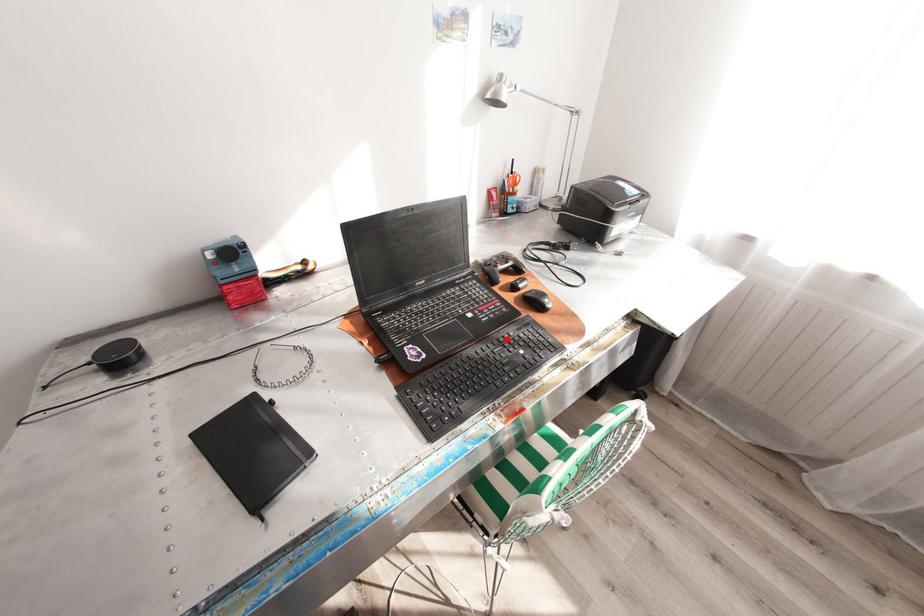
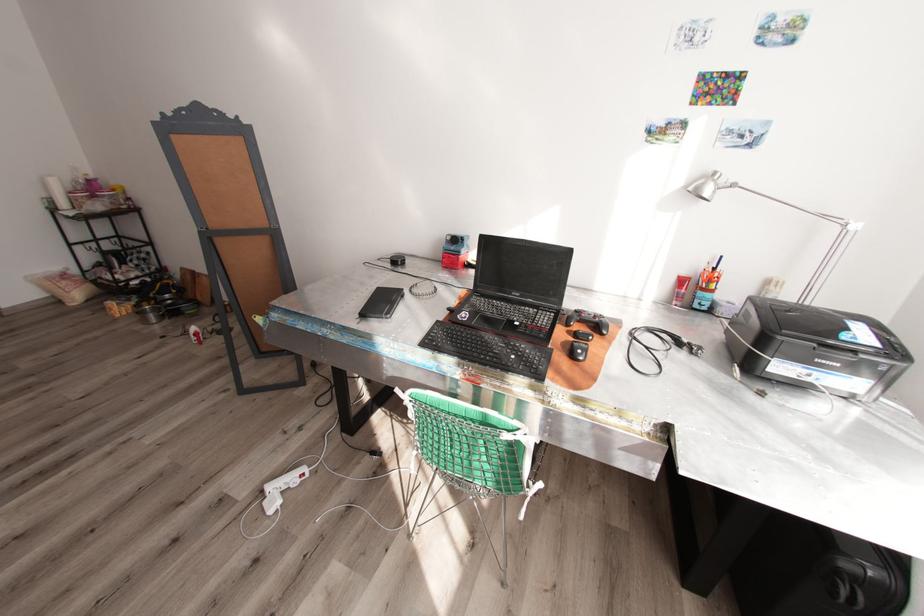
Question: I am providing you with two images of the same scene from different viewpoints. A red point is marked on the first image. Can you still see the location of the red point in image 2?

Choices:
 (A) Yes
 (B) No

Answer: (A)